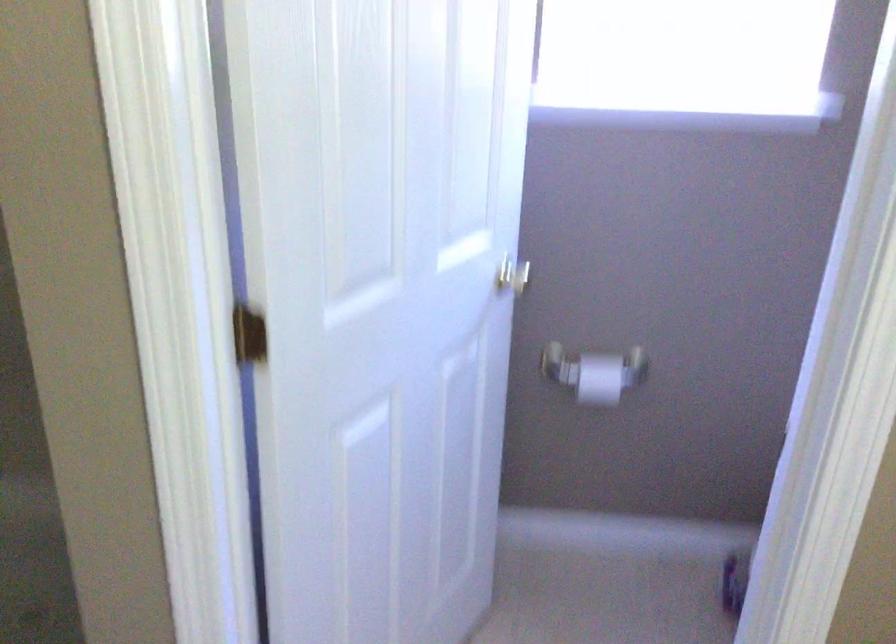
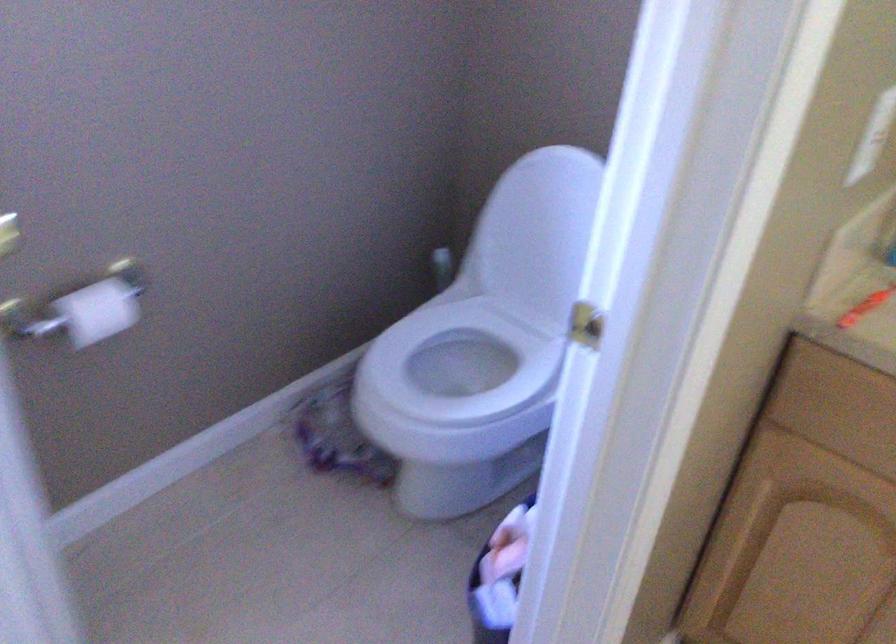
Based on the continuous images, in which direction is the camera rotating?

The rotation direction of the camera is right-down.